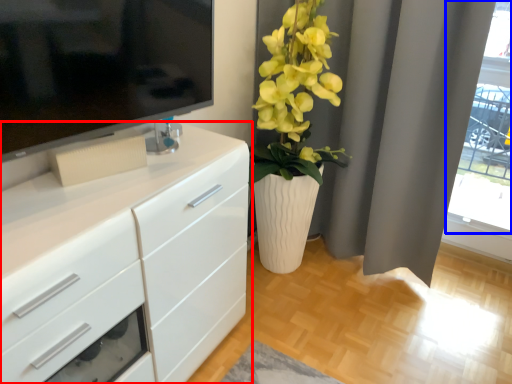
Question: Among these objects, which one is farthest to the camera, chest of drawers (highlighted by a red box) or glass door (highlighted by a blue box)?

Choices:
 (A) chest of drawers
 (B) glass door

Answer: (B)